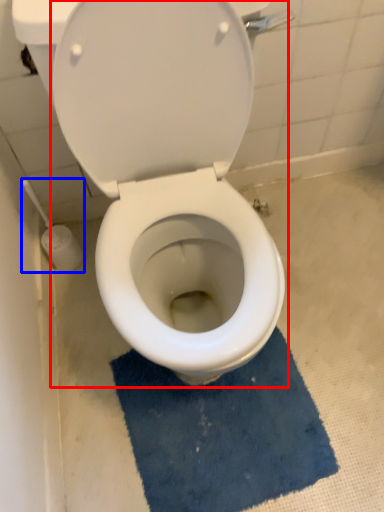
Question: Which of the following is the closest to the observer, toilet (highlighted by a red box) or brush (highlighted by a blue box)?

Choices:
 (A) toilet
 (B) brush

Answer: (A)